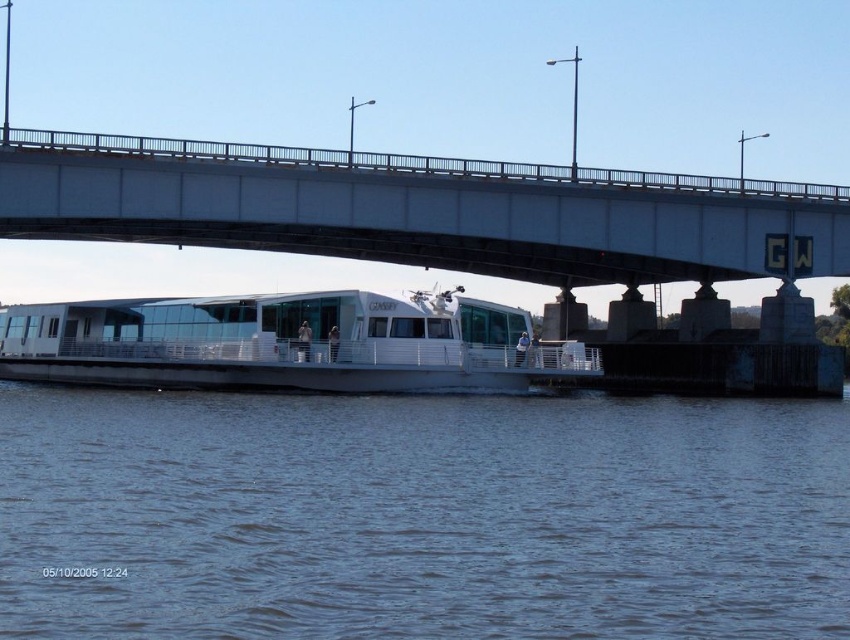
Question: Is white concrete bridge at upper center smaller than white glossy boat at center?

Choices:
 (A) yes
 (B) no

Answer: (A)

Question: Considering the relative positions of blue water at lower center and white concrete bridge at upper center in the image provided, where is blue water at lower center located with respect to white concrete bridge at upper center?

Choices:
 (A) left
 (B) right

Answer: (B)

Question: Can you confirm if white concrete bridge at upper center is positioned to the left of white glossy boat at center?

Choices:
 (A) no
 (B) yes

Answer: (A)

Question: Which point is farther from the camera taking this photo?

Choices:
 (A) (47, 196)
 (B) (248, 627)

Answer: (A)

Question: Which point is closer to the camera?

Choices:
 (A) (604, 244)
 (B) (280, 358)

Answer: (B)

Question: Which object is the closest to the white glossy boat at center?

Choices:
 (A) white concrete bridge at upper center
 (B) blue water at lower center

Answer: (A)